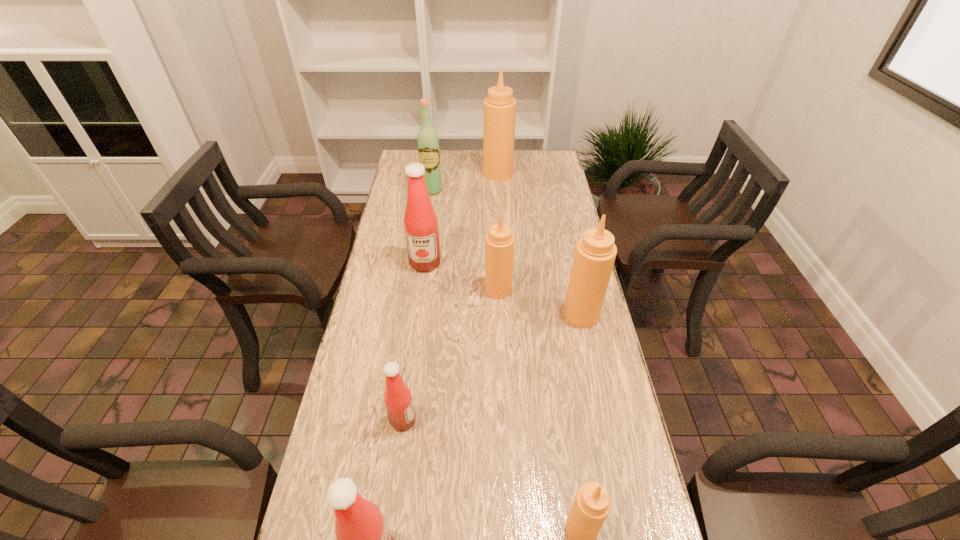
You are a GUI agent. You are given a task and a screenshot of the screen. Output one action in this format:
    pyautogui.click(x=<x>, y=<y>)
    Task: Click on the condiment that is the closest to the farthest object
    
    Given the screenshot: What is the action you would take?
    pyautogui.click(x=420, y=221)

Find the location of a particular element. The height and width of the screenshot is (540, 960). the second closest condiment to the wine bottle is located at coordinates (420, 221).

Image resolution: width=960 pixels, height=540 pixels. What are the coordinates of `the fourth closest tan condiment to the second farthest object` in the screenshot? It's located at (592, 504).

At what (x,y) coordinates should I click in order to perform the action: click on the third closest tan condiment to the fifth nearest condiment. Please return your answer as a coordinate pair (x, y). Looking at the image, I should click on (592, 504).

Where is `red condiment that is the second nearest to the sixth nearest object`? This screenshot has height=540, width=960. red condiment that is the second nearest to the sixth nearest object is located at coordinates [x=363, y=538].

Locate an element on the screen. red condiment that is the nearest to the seventh nearest object is located at coordinates (420, 221).

You are a GUI agent. You are given a task and a screenshot of the screen. Output one action in this format:
    pyautogui.click(x=<x>, y=<y>)
    Task: Click on the blank area in the image that satisfies the following two spatial constraints: 1. on the front-facing side of the seventh nearest object; 2. on the left side of the fifth nearest condiment
    The height and width of the screenshot is (540, 960).
    Given the screenshot: What is the action you would take?
    pyautogui.click(x=419, y=290)

Locate an element on the screen. This screenshot has width=960, height=540. free space that satisfies the following two spatial constraints: 1. on the front-facing side of the fifth nearest object; 2. on the right side of the sixth nearest condiment is located at coordinates (421, 290).

This screenshot has width=960, height=540. In order to click on vacant space that satisfies the following two spatial constraints: 1. on the front-facing side of the white wine bottle; 2. on the right side of the third biggest tan condiment in this screenshot , I will do `click(419, 290)`.